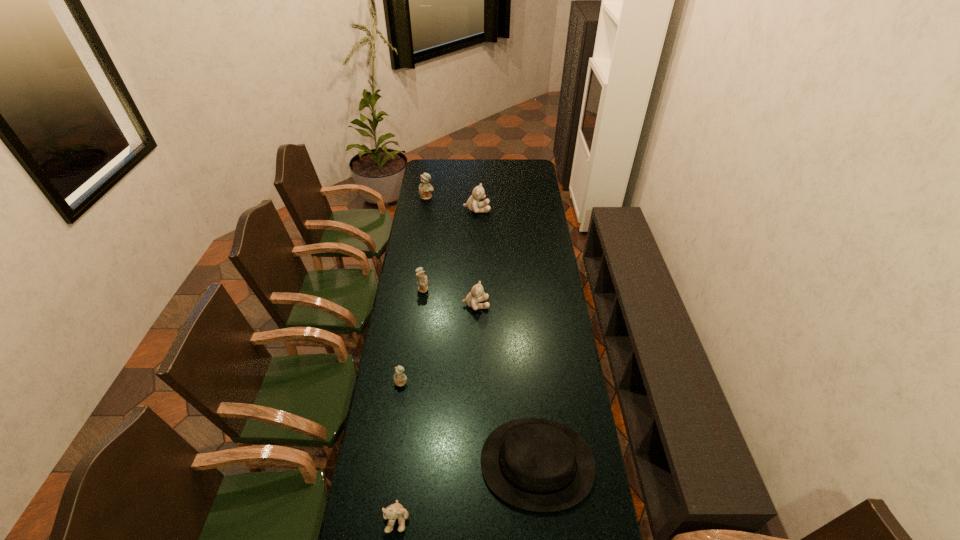
I want to click on vacant space at the far edge, so pyautogui.click(x=482, y=163).

I want to click on vacant area at the left edge, so click(389, 492).

In the image, there is a desktop. What are the coordinates of `free space at the right edge` in the screenshot? It's located at (544, 193).

Identify the location of vacant space at the far left corner of the desktop. Image resolution: width=960 pixels, height=540 pixels. (435, 165).

The width and height of the screenshot is (960, 540). Identify the location of free space at the far right corner of the desktop. (521, 161).

Find the location of a particular element. unoccupied area between the second farthest gray teddy bear and the biggest blue teddy bear is located at coordinates (451, 251).

This screenshot has width=960, height=540. Identify the location of free area in between the third farthest object and the fifth nearest teddy bear. (450, 249).

Locate an element on the screen. vacant area between the farthest teddy bear and the third farthest teddy bear is located at coordinates (425, 242).

I want to click on unoccupied position between the biggest blue teddy bear and the second nearest gray teddy bear, so click(x=451, y=251).

I want to click on free space between the third nearest object and the nearest gray teddy bear, so click(399, 450).